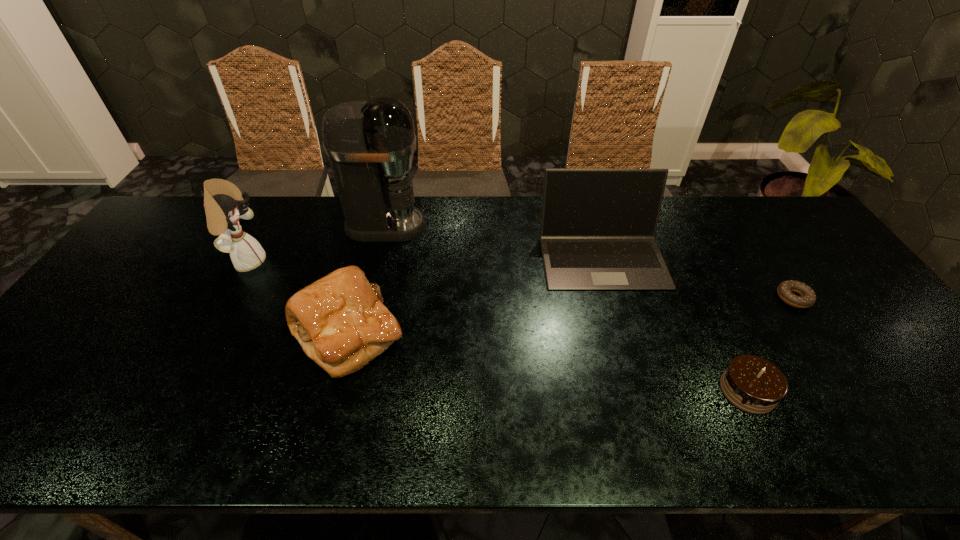
Locate an element on the screen. object present at the right edge is located at coordinates (807, 298).

The image size is (960, 540). In order to click on vacant space at the far edge of the desktop in this screenshot , I will do `click(342, 240)`.

Where is `vacant point at the near edge`? Image resolution: width=960 pixels, height=540 pixels. vacant point at the near edge is located at coordinates (523, 427).

What are the coordinates of `free region at the left edge of the desktop` in the screenshot? It's located at (140, 248).

Image resolution: width=960 pixels, height=540 pixels. In the image, there is a desktop. In order to click on vacant space at the right edge in this screenshot , I will do `click(914, 390)`.

In order to click on free space at the far left corner in this screenshot , I will do `click(198, 208)`.

You are a GUI agent. You are given a task and a screenshot of the screen. Output one action in this format:
    pyautogui.click(x=<x>, y=<y>)
    Task: Click on the free space between the leftmost object and the laptop
    
    Given the screenshot: What is the action you would take?
    pyautogui.click(x=424, y=259)

This screenshot has height=540, width=960. I want to click on free point between the tallest object and the fourth shortest object, so click(493, 241).

In order to click on empty space between the second shortest object and the rightmost object in this screenshot , I will do `click(770, 345)`.

What are the coordinates of `free space between the fifth object from left to right and the bread` in the screenshot? It's located at (548, 362).